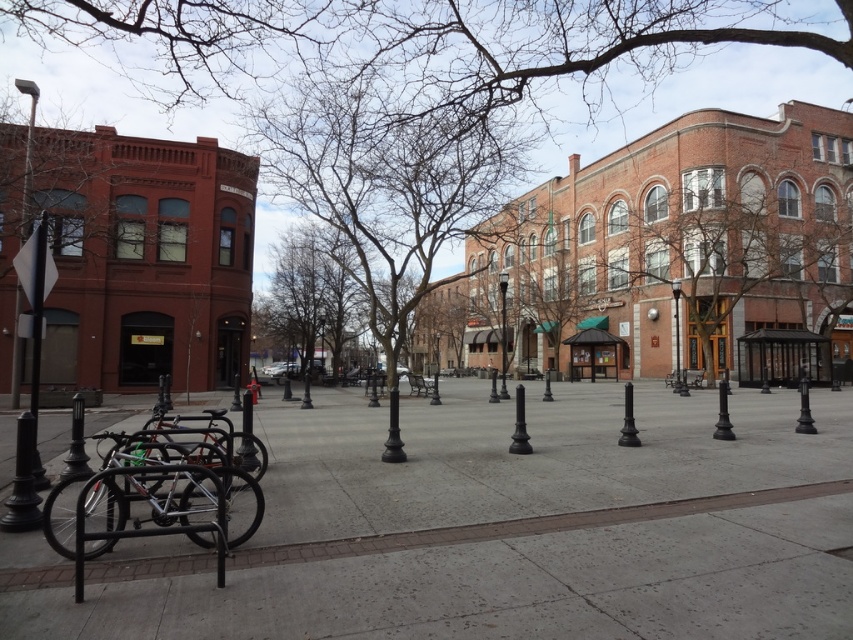
Question: Estimate the real-world distances between objects in this image. Which object is closer to the polished metal lamp post at center?

Choices:
 (A) silver metallic bicycle at lower left
 (B) brown textured building at upper right

Answer: (B)

Question: Does brown textured building at upper right have a smaller size compared to silver metallic lamp post at center?

Choices:
 (A) yes
 (B) no

Answer: (B)

Question: Which object is the closest to the silver metallic bicycle at lower left?

Choices:
 (A) black glossy pole at left
 (B) gray concrete pavement at lower left

Answer: (A)

Question: Which point is farther to the camera?

Choices:
 (A) bare branches at center
 (B) brown textured building at upper right
 (C) gray concrete pavement at lower left

Answer: (B)

Question: Does black glossy pole at left lie behind silver metallic lamp post at center?

Choices:
 (A) no
 (B) yes

Answer: (A)

Question: Observing the image, what is the correct spatial positioning of bare branches at center in reference to black glossy pole at left?

Choices:
 (A) left
 (B) right

Answer: (B)